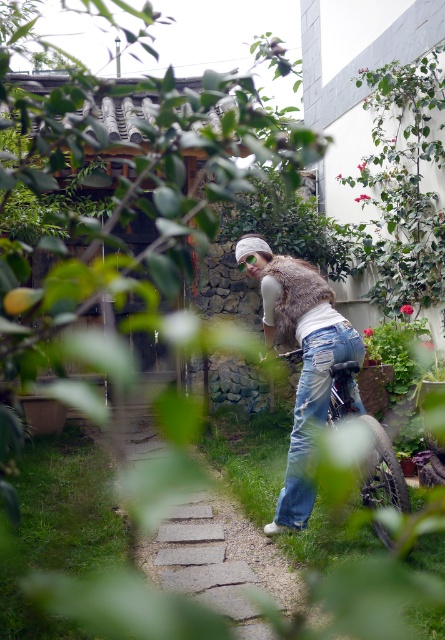
You are a visitor in this garden and want to walk along the stone paved path at center without stepping on the denim jeans at center. Is this possible?

The stone paved path at center is below denim jeans at center, so you can walk along the stone paved path at center without stepping on the denim jeans at center since it is positioned underneath.

You are a delivery person standing on the stone paved path at center and need to reach the fur vest at center to pick it up. Can you reach it without moving from your current position?

The distance between the stone paved path at center and the fur vest at center is 3.58 feet. Since this distance is greater than an average person arm length of about 2.5 feet, you cannot reach the fur vest at center without moving from your current position on the stone paved path at center.